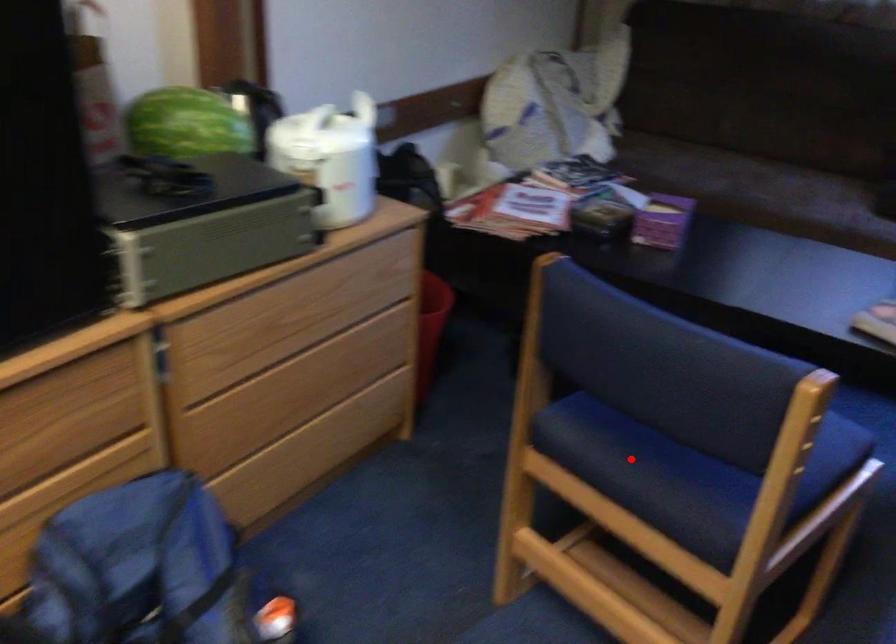
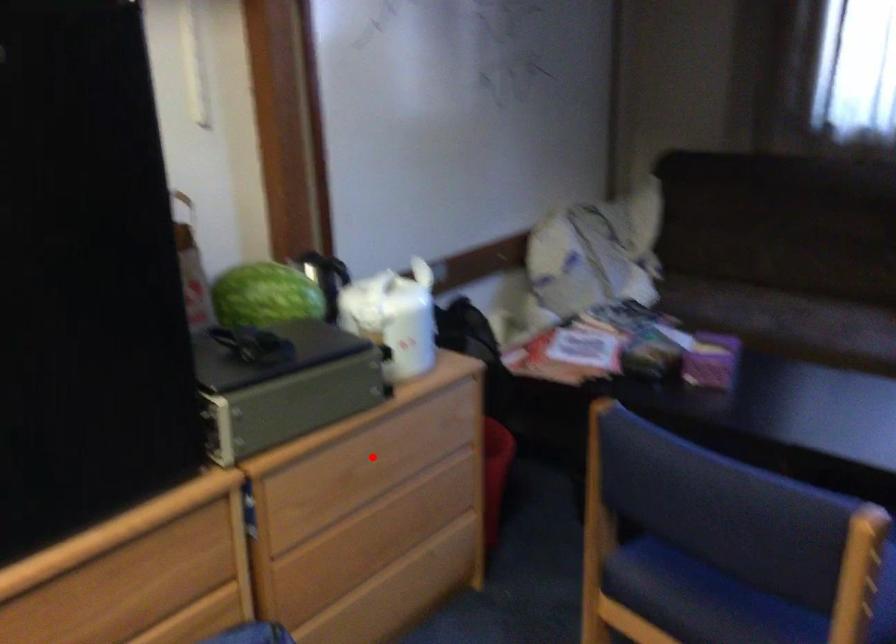
I am providing you with two images of the same scene from different viewpoints. A red point is marked on the first image and another point is marked on the second image. Does the point marked in image1 correspond to the same location as the one in image2?

No